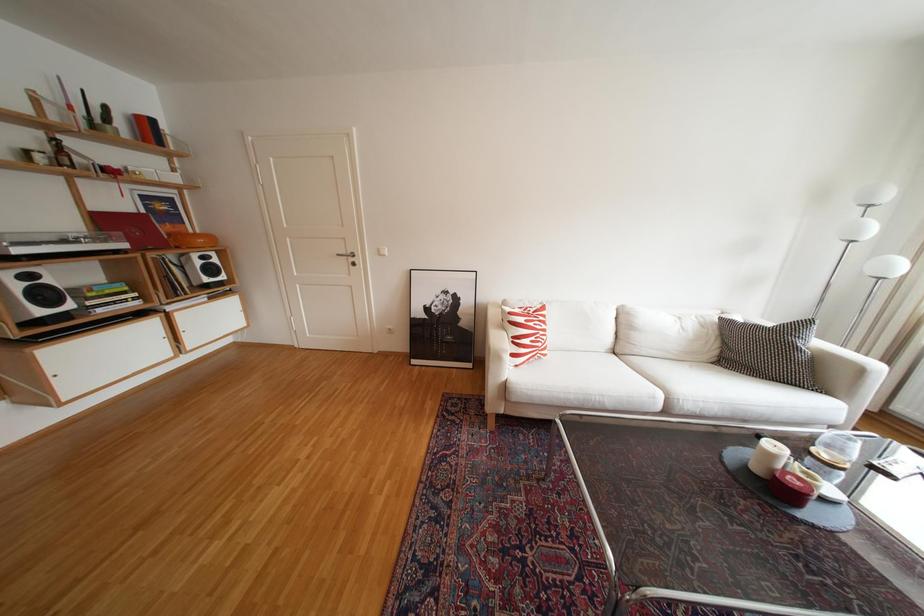
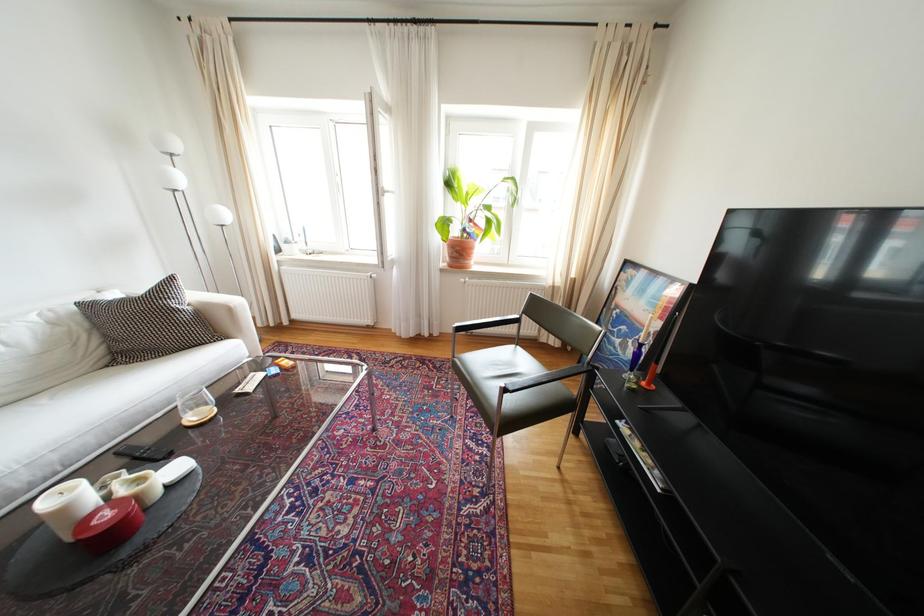
Based on the continuous images, in which direction is the camera rotating?

The camera rotated toward right-down.